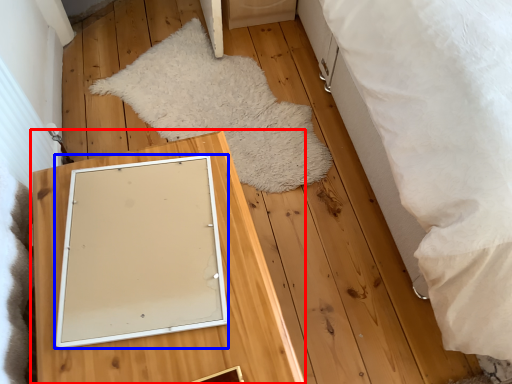
Question: Which object is further to the camera taking this photo, furniture (highlighted by a red box) or picture frame (highlighted by a blue box)?

Choices:
 (A) furniture
 (B) picture frame

Answer: (B)